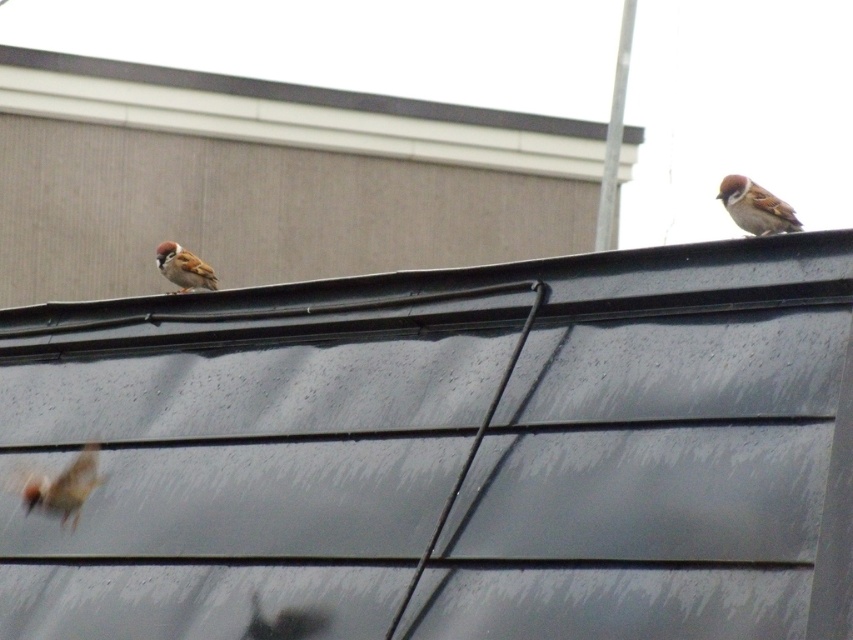
You are a birdhouse builder who needs to install a bird feeder. You see the gray matte roof at center and the brown speckled feathers at upper right. Which object is closer to the bird feeder that you are holding?

The gray matte roof at center is closer to the brown speckled feathers at upper right by 5.89 feet, so the bird feeder should be placed near the gray matte roof at center to be closer to both objects.

You are standing in the backyard and see the gray matte roof at center and the brown matte sparrow at lower left. Which object is positioned to the right of the other?

The gray matte roof at center is to the right of the brown matte sparrow at lower left.

You are standing in front of the gray matte roof at center and want to reach the brown matte sparrow at left. Which direction should you move to get closer to the sparrow?

Since the gray matte roof at center is closer to you than the brown matte sparrow at left, you should move forward towards the roof to get closer to the sparrow.